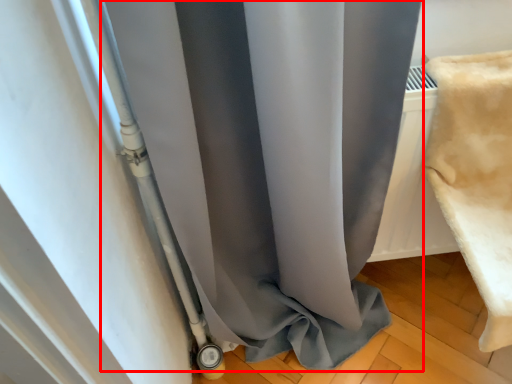
Question: From the image's perspective, what is the correct spatial relationship of curtain (annotated by the red box) in relation to material?

Choices:
 (A) above
 (B) below

Answer: (B)